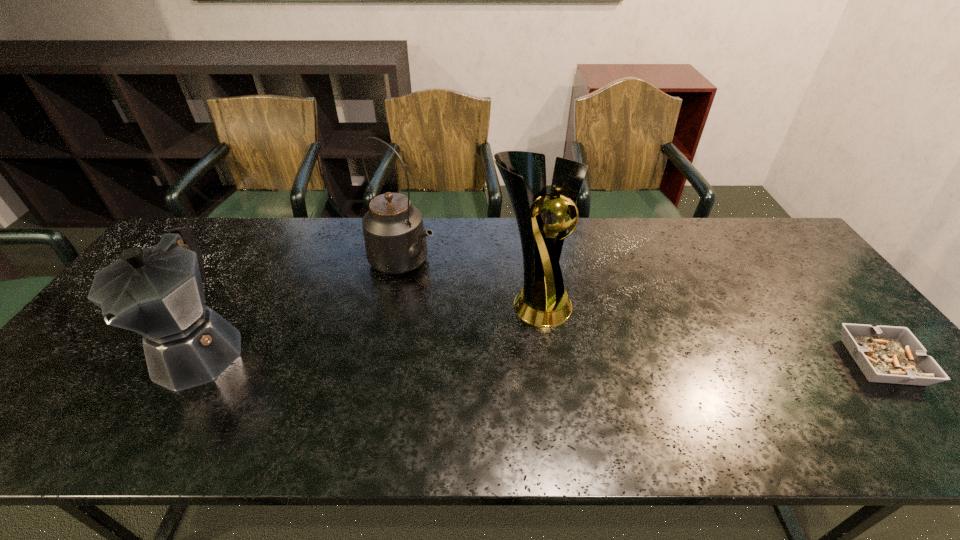
Identify the location of vacant spot on the desktop that is between the third tallest object and the ashtray and is positioned spout on the second tallest object. (552, 356).

This screenshot has height=540, width=960. I want to click on vacant space on the desktop that is between the third tallest object and the rightmost object and is positioned at the front of the award, where the globe is visible, so click(634, 357).